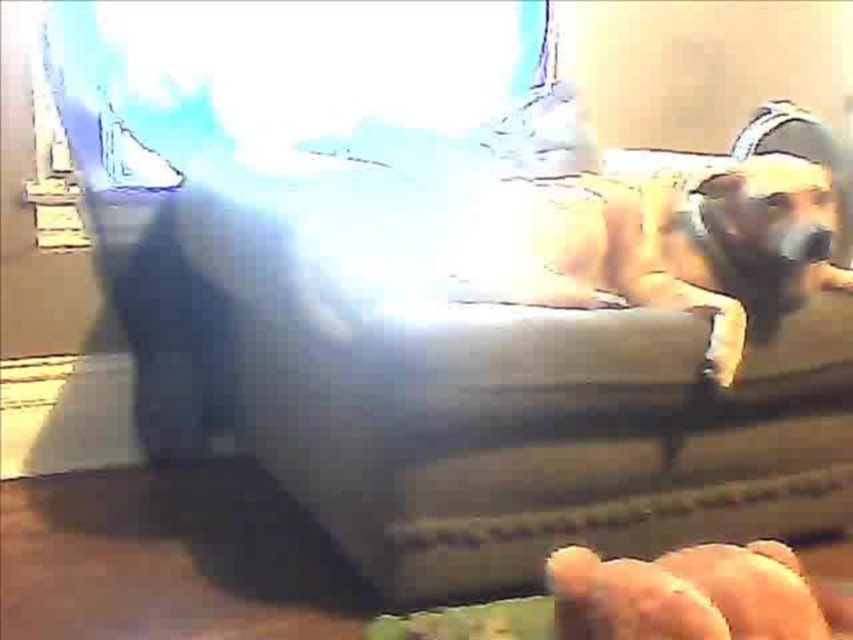
Question: Can you confirm if furry beige dog at center is positioned above smooth leather hand at lower right?

Choices:
 (A) yes
 (B) no

Answer: (A)

Question: Is furry beige dog at center smaller than smooth leather hand at lower right?

Choices:
 (A) yes
 (B) no

Answer: (B)

Question: Is furry beige dog at center wider than smooth leather hand at lower right?

Choices:
 (A) yes
 (B) no

Answer: (A)